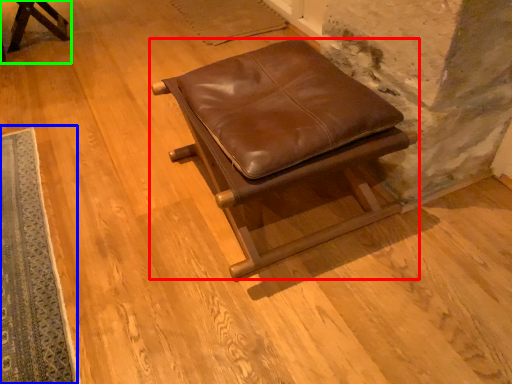
Question: Which is farther away from furniture (highlighted by a red box)? mat (highlighted by a blue box) or furniture (highlighted by a green box)?

Choices:
 (A) mat
 (B) furniture

Answer: (B)